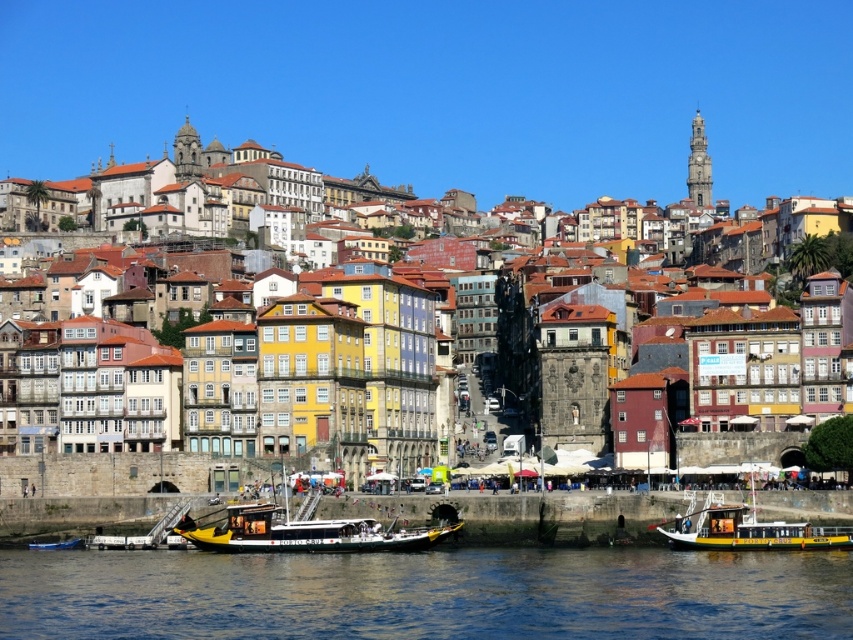
You are a tourist standing on the riverside promenade and want to take a photo of both the multicolored stone buildings at lower left and the yellow matte boat at lower right. Based on their positions, will you need to adjust your camera angle to capture both in the same frame?

The multicolored stone buildings at lower left is located above the yellow matte boat at lower right, so you will need to adjust your camera angle to capture both in the same frame.

You are a tourist standing on the riverside promenade and want to take a photo of the multicolored stone buildings at lower left and the blue painted wooden boat at lower left. Which object will appear larger in your photo?

The multicolored stone buildings at lower left will appear larger in your photo because they are taller than the blue painted wooden boat at lower left.